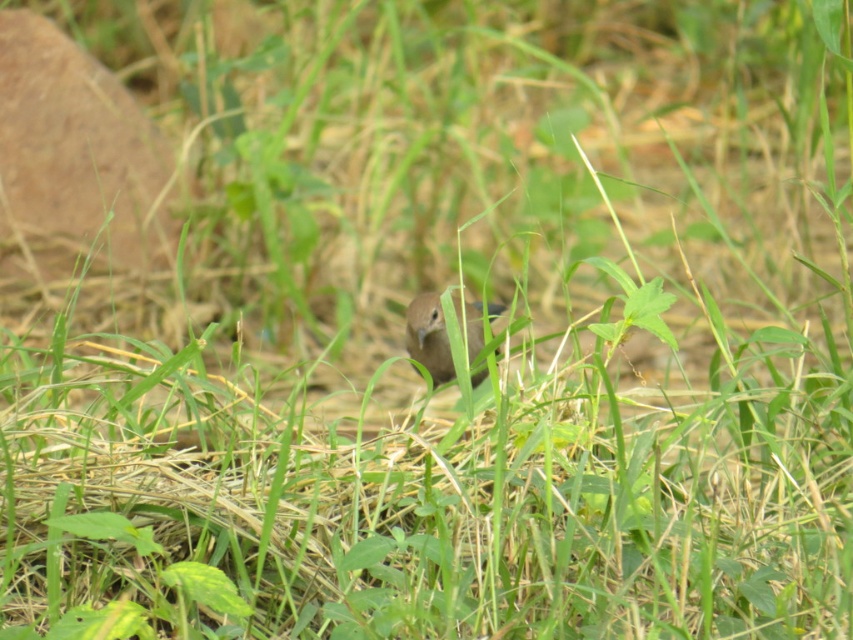
Looking at this image, you are a photographer trying to capture the brown matte bird at center. You notice the brown rock at upper left might be blocking your view. Is the bird visible through the rock?

The brown matte bird at center is behind the brown rock at upper left, so it is partially or fully obscured by the rock, making it less visible.

You are a photographer trying to capture the bird in the scene. You notice two points marked in the image. Which point is closer to your camera lens? Please choose between point (126,264) and point (469,364).

Point (126,264) is further to the viewer than point (469,364), so the point closer to your camera lens is point (126,264).